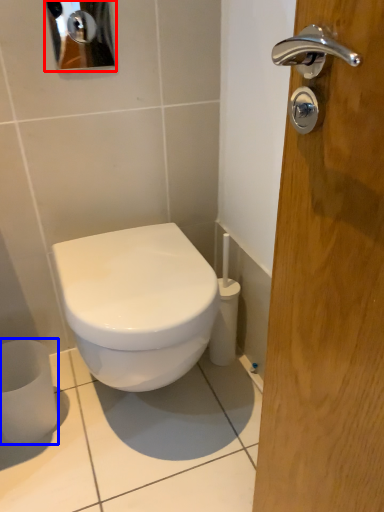
Question: Which point is further to the camera, mirror (highlighted by a red box) or toilet paper (highlighted by a blue box)?

Choices:
 (A) mirror
 (B) toilet paper

Answer: (B)